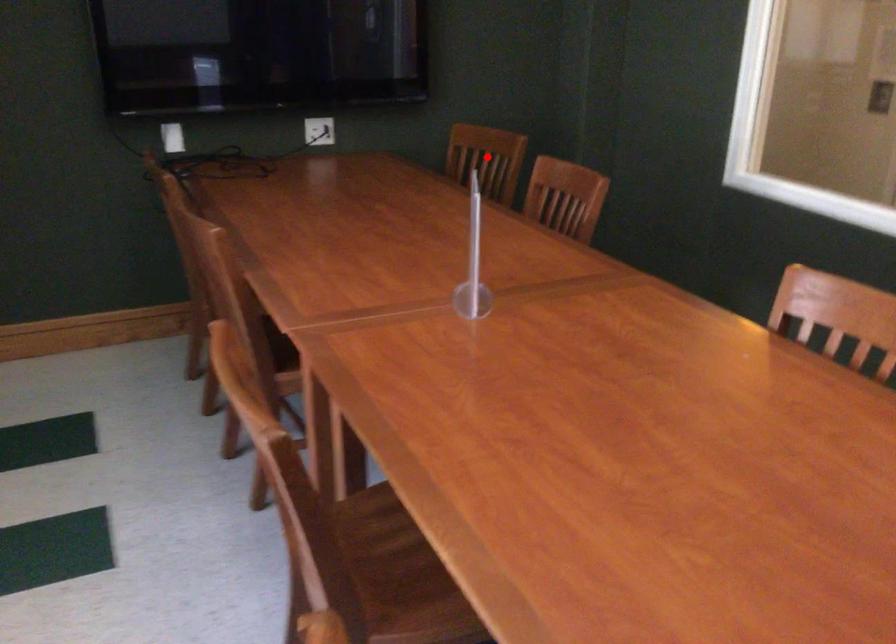
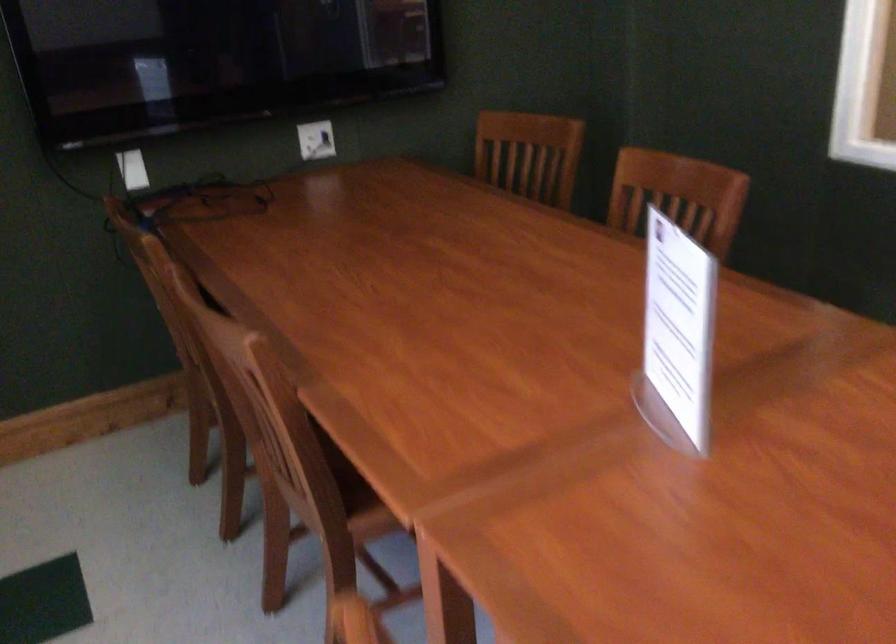
Find the pixel in the second image that matches the highlighted location in the first image.

(529, 154)